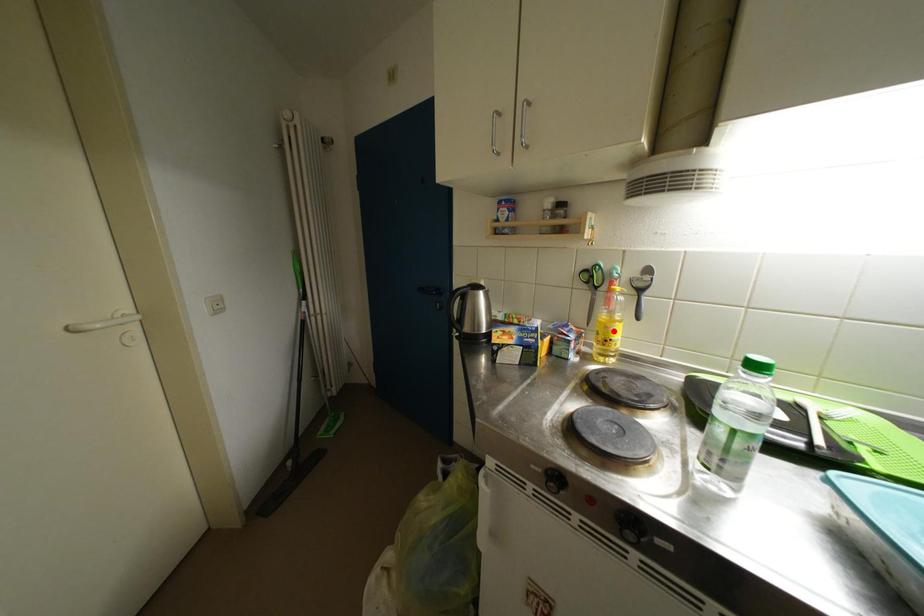
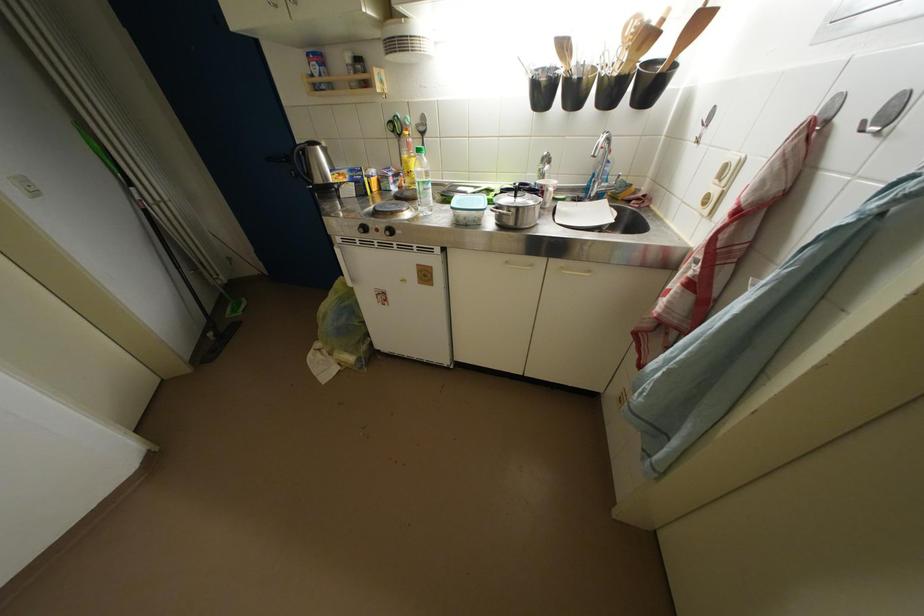
Question: I am providing you with two images of the same scene from different viewpoints. A red point is marked on the first image. Is the red point's position out of view in image 2?

Choices:
 (A) Yes
 (B) No

Answer: (B)